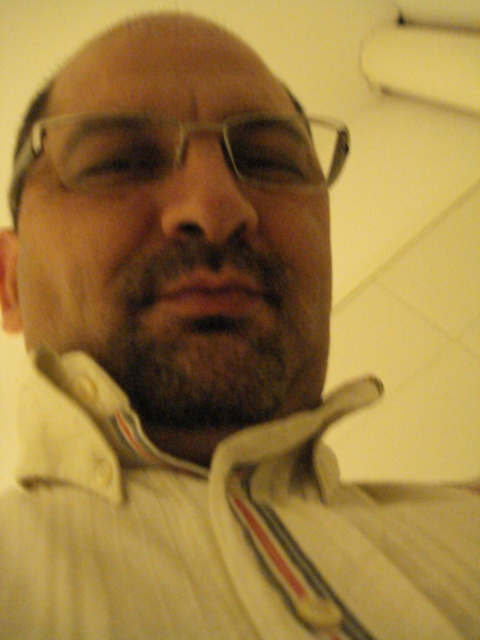
Question: Which point is closer to the camera?

Choices:
 (A) (308, 152)
 (B) (242, 584)

Answer: (B)

Question: Is white ribbed fabric at center positioned at the back of clear plastic glasses at center?

Choices:
 (A) yes
 (B) no

Answer: (B)

Question: Is white ribbed fabric at center above clear plastic glasses at center?

Choices:
 (A) yes
 (B) no

Answer: (B)

Question: Does white ribbed fabric at center lie behind clear plastic glasses at center?

Choices:
 (A) no
 (B) yes

Answer: (A)

Question: Which point is farther from the camera taking this photo?

Choices:
 (A) (144, 163)
 (B) (167, 506)

Answer: (A)

Question: Which point is farther to the camera?

Choices:
 (A) white ribbed fabric at center
 (B) clear plastic glasses at center

Answer: (B)